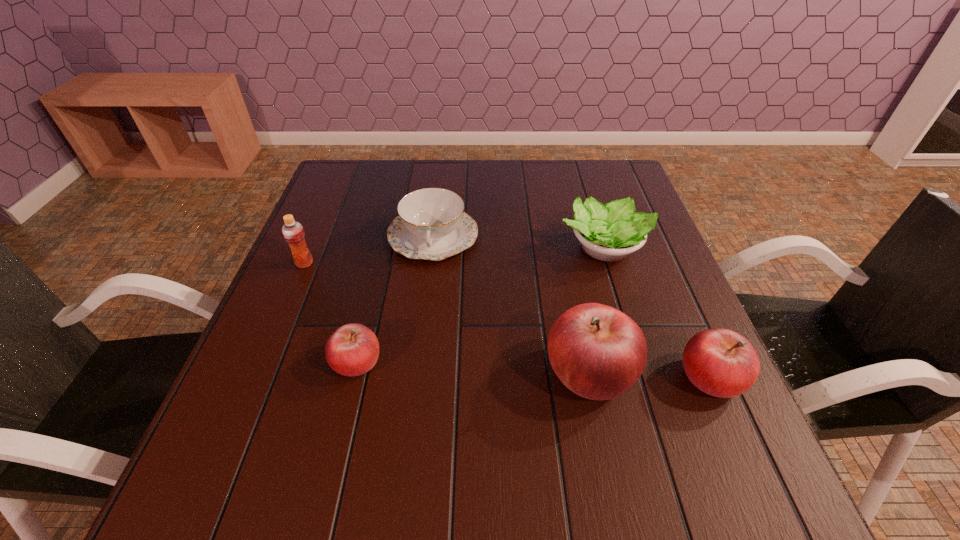
Where is `vacant space at the near right corner of the desktop`? The image size is (960, 540). vacant space at the near right corner of the desktop is located at coordinates (657, 400).

Locate an element on the screen. The width and height of the screenshot is (960, 540). vacant area that lies between the chinaware and the lettuce is located at coordinates (518, 242).

In order to click on free point between the lettuce and the shortest apple in this screenshot , I will do `click(480, 305)`.

Where is `empty space between the rightmost apple and the leftmost apple`? empty space between the rightmost apple and the leftmost apple is located at coordinates (534, 369).

This screenshot has height=540, width=960. I want to click on unoccupied position between the shortest apple and the lettuce, so click(x=480, y=305).

Where is `free area in between the second tallest object and the leftmost apple`? free area in between the second tallest object and the leftmost apple is located at coordinates (330, 313).

The image size is (960, 540). I want to click on vacant area between the chinaware and the lettuce, so click(x=518, y=242).

Where is `free spot between the leftmost apple and the second apple from left to right`? The image size is (960, 540). free spot between the leftmost apple and the second apple from left to right is located at coordinates (473, 367).

Identify the location of free space between the chinaware and the orange juice. This screenshot has height=540, width=960. (369, 249).

Where is `vacant area that lies between the lettuce and the chinaware`? The height and width of the screenshot is (540, 960). vacant area that lies between the lettuce and the chinaware is located at coordinates (518, 242).